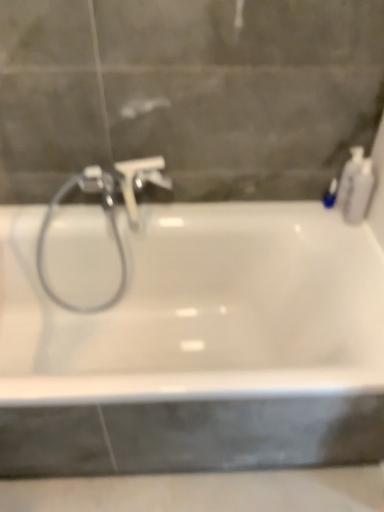
The width and height of the screenshot is (384, 512). I want to click on white plastic soap dispenser at upper right, marked as the 2th toiletry in a left-to-right arrangement, so click(x=349, y=176).

Where is `satin nickel faucet at center`? The image size is (384, 512). satin nickel faucet at center is located at coordinates (124, 181).

You are a GUI agent. You are given a task and a screenshot of the screen. Output one action in this format:
    pyautogui.click(x=<x>, y=<y>)
    Task: Click on the satin nickel faucet at upper left
    
    Given the screenshot: What is the action you would take?
    pyautogui.click(x=106, y=210)

Looking at this image, who is shorter, satin nickel faucet at center or white glossy bathtub at center?

With less height is satin nickel faucet at center.

Considering the relative sizes of satin nickel faucet at center and white glossy bathtub at center in the image provided, is satin nickel faucet at center wider than white glossy bathtub at center?

No, satin nickel faucet at center is not wider than white glossy bathtub at center.

Which is nearer, [101,170] or [18,251]?

The point [101,170] is closer.

Is the depth of satin nickel faucet at center greater than that of white glossy bathtub at center?

Yes, the depth of satin nickel faucet at center is greater than that of white glossy bathtub at center.

Is white plastic soap dispenser at upper right, marked as the 2th toiletry in a left-to-right arrangement, in front of or behind satin nickel faucet at center in the image?

Clearly, white plastic soap dispenser at upper right, marked as the 2th toiletry in a left-to-right arrangement, is behind satin nickel faucet at center.

I want to click on tap lying below the white plastic soap dispenser at upper right, the 2th toiletry in the right-to-left sequence (from the image's perspective), so click(124, 181).

From a real-world perspective, which object stands above the other?

white plastic soap dispenser at upper right, marked as the 2th toiletry in a left-to-right arrangement, from a real-world perspective.

Considering the sizes of objects blue glossy bottle at upper right, the 3th toiletry from the right, and satin nickel faucet at center in the image provided, who is taller, blue glossy bottle at upper right, the 3th toiletry from the right, or satin nickel faucet at center?

satin nickel faucet at center is taller.

Looking at this image, is blue glossy bottle at upper right, the 3th toiletry from the right, thinner than satin nickel faucet at center?

Yes, blue glossy bottle at upper right, the 3th toiletry from the right, is thinner than satin nickel faucet at center.

Considering the relative positions of blue glossy bottle at upper right, which ranks as the first toiletry in left-to-right order, and satin nickel faucet at center in the image provided, is blue glossy bottle at upper right, which ranks as the first toiletry in left-to-right order, to the left or to the right of satin nickel faucet at center?

blue glossy bottle at upper right, which ranks as the first toiletry in left-to-right order, is positioned on satin nickel faucet at center's right side.

Which is in front, blue glossy bottle at upper right, which ranks as the first toiletry in left-to-right order, or satin nickel faucet at center?

Positioned in front is satin nickel faucet at center.

From a real-world perspective, is white glossy bathtub at center physically located above or below white plastic soap dispenser at upper right, the 2th toiletry in the right-to-left sequence?

Clearly, from a real-world perspective, white glossy bathtub at center is below white plastic soap dispenser at upper right, the 2th toiletry in the right-to-left sequence.

Would you say white glossy bathtub at center is outside white plastic soap dispenser at upper right, the 2th toiletry in the right-to-left sequence?

Yes, white glossy bathtub at center is not within white plastic soap dispenser at upper right, the 2th toiletry in the right-to-left sequence.

Find the location of a particular element. the 2nd toiletry behind the white glossy bathtub at center is located at coordinates (349, 176).

Is point (175, 254) in front of point (352, 176)?

No, it is not.

From the picture: Is satin nickel faucet at upper left oriented away from white plastic bottle at right, which appears as the first toiletry when viewed from the right?

satin nickel faucet at upper left is not turned away from white plastic bottle at right, which appears as the first toiletry when viewed from the right.

Is satin nickel faucet at upper left closer to the viewer compared to white plastic bottle at right, the 3th toiletry positioned from the left?

Yes, the depth of satin nickel faucet at upper left is less than that of white plastic bottle at right, the 3th toiletry positioned from the left.

In the scene shown: From the image's perspective, would you say satin nickel faucet at upper left is positioned over white plastic bottle at right, the 3th toiletry positioned from the left?

No.

From the satin nickel faucet at upper left, count 1st toiletrys backward and point to it. Please provide its 2D coordinates.

[(357, 189)]

Would you say white plastic soap dispenser at upper right, marked as the 2th toiletry in a left-to-right arrangement, contains satin nickel faucet at upper left?

Actually, satin nickel faucet at upper left is outside white plastic soap dispenser at upper right, marked as the 2th toiletry in a left-to-right arrangement.

Looking at their sizes, would you say white plastic soap dispenser at upper right, marked as the 2th toiletry in a left-to-right arrangement, is wider or thinner than satin nickel faucet at upper left?

Clearly, white plastic soap dispenser at upper right, marked as the 2th toiletry in a left-to-right arrangement, has less width compared to satin nickel faucet at upper left.

Does white plastic soap dispenser at upper right, marked as the 2th toiletry in a left-to-right arrangement, turn towards satin nickel faucet at upper left?

Yes.

From the image's perspective, which is above, white plastic soap dispenser at upper right, marked as the 2th toiletry in a left-to-right arrangement, or satin nickel faucet at upper left?

white plastic soap dispenser at upper right, marked as the 2th toiletry in a left-to-right arrangement.

In the scene shown: Between white plastic soap dispenser at upper right, the 2th toiletry in the right-to-left sequence, and blue glossy bottle at upper right, which ranks as the first toiletry in left-to-right order, which one has smaller width?

blue glossy bottle at upper right, which ranks as the first toiletry in left-to-right order.

Is white plastic soap dispenser at upper right, the 2th toiletry in the right-to-left sequence, far from blue glossy bottle at upper right, the 3th toiletry from the right?

Actually, white plastic soap dispenser at upper right, the 2th toiletry in the right-to-left sequence, and blue glossy bottle at upper right, the 3th toiletry from the right, are a little close together.

Is point (346, 165) positioned in front of point (326, 206)?

Yes, it is.

This screenshot has width=384, height=512. What are the coordinates of `toiletry on the left side of white plastic soap dispenser at upper right, marked as the 2th toiletry in a left-to-right arrangement` in the screenshot? It's located at (330, 194).

The width and height of the screenshot is (384, 512). In order to click on tap that is on the left side of white glossy bathtub at center in this screenshot , I will do `click(124, 181)`.

The height and width of the screenshot is (512, 384). I want to click on tap in front of the white plastic soap dispenser at upper right, the 2th toiletry in the right-to-left sequence, so click(124, 181).

From the image, which object appears to be farther from satin nickel faucet at upper left, blue glossy bottle at upper right, the 3th toiletry from the right, or white glossy bathtub at center?

blue glossy bottle at upper right, the 3th toiletry from the right, lies further to satin nickel faucet at upper left than the other object.

When comparing their distances from satin nickel faucet at upper left, does white plastic soap dispenser at upper right, the 2th toiletry in the right-to-left sequence, or satin nickel faucet at center seem closer?

satin nickel faucet at center lies closer to satin nickel faucet at upper left than the other object.

Which object lies further to the anchor point satin nickel faucet at upper left, white plastic soap dispenser at upper right, marked as the 2th toiletry in a left-to-right arrangement, or blue glossy bottle at upper right, the 3th toiletry from the right?

blue glossy bottle at upper right, the 3th toiletry from the right, is further to satin nickel faucet at upper left.

Considering their positions, is white plastic bottle at right, which appears as the first toiletry when viewed from the right, positioned closer to satin nickel faucet at upper left than white plastic soap dispenser at upper right, the 2th toiletry in the right-to-left sequence?

Based on the image, white plastic bottle at right, which appears as the first toiletry when viewed from the right, appears to be nearer to satin nickel faucet at upper left.

When comparing their distances from white glossy bathtub at center, does blue glossy bottle at upper right, the 3th toiletry from the right, or white plastic soap dispenser at upper right, the 2th toiletry in the right-to-left sequence, seem further?

Among the two, blue glossy bottle at upper right, the 3th toiletry from the right, is located further to white glossy bathtub at center.

When comparing their distances from blue glossy bottle at upper right, the 3th toiletry from the right, does white plastic bottle at right, which appears as the first toiletry when viewed from the right, or satin nickel faucet at center seem further?

satin nickel faucet at center is further to blue glossy bottle at upper right, the 3th toiletry from the right.

Looking at the image, which one is located further to white glossy bathtub at center, satin nickel faucet at upper left or satin nickel faucet at center?

satin nickel faucet at center is further to white glossy bathtub at center.

Based on their spatial positions, is satin nickel faucet at upper left or white glossy bathtub at center closer to blue glossy bottle at upper right, which ranks as the first toiletry in left-to-right order?

white glossy bathtub at center.

Where is `bathtub between satin nickel faucet at upper left and white plastic soap dispenser at upper right, marked as the 2th toiletry in a left-to-right arrangement, from left to right`? bathtub between satin nickel faucet at upper left and white plastic soap dispenser at upper right, marked as the 2th toiletry in a left-to-right arrangement, from left to right is located at coordinates (202, 306).

The image size is (384, 512). Find the location of `plumbing fixture that lies between satin nickel faucet at center and white glossy bathtub at center from top to bottom`. plumbing fixture that lies between satin nickel faucet at center and white glossy bathtub at center from top to bottom is located at coordinates (106, 210).

Locate an element on the screen. bathtub between satin nickel faucet at upper left and white plastic bottle at right, the 3th toiletry positioned from the left, from left to right is located at coordinates click(202, 306).

In order to click on toiletry located between satin nickel faucet at center and white plastic soap dispenser at upper right, the 2th toiletry in the right-to-left sequence, in the left-right direction in this screenshot , I will do `click(330, 194)`.